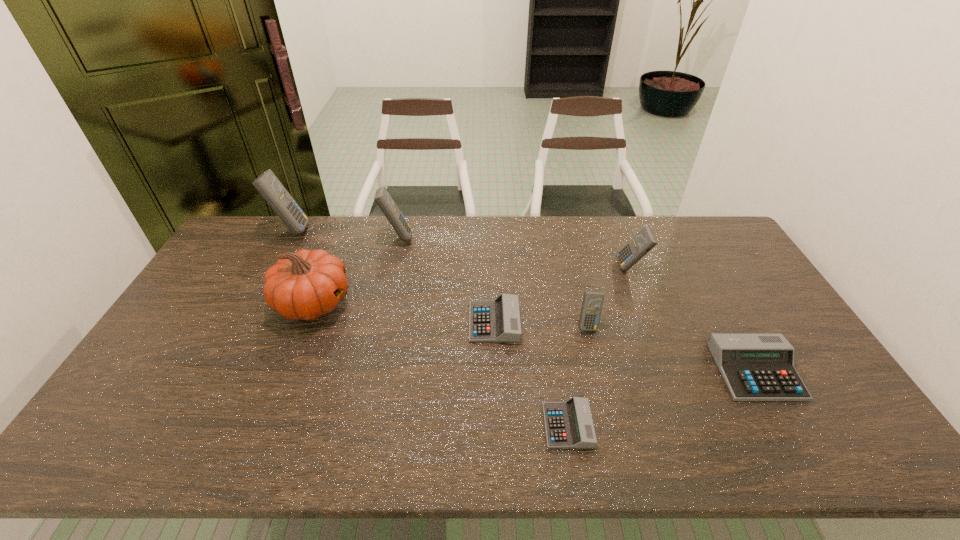
Identify the location of empty space between the third tallest calculator and the pumpkin. (472, 285).

This screenshot has width=960, height=540. I want to click on free spot between the fifth object from right to left and the third tallest calculator, so click(x=563, y=294).

The width and height of the screenshot is (960, 540). I want to click on unoccupied position between the tallest object and the fourth calculator from right to left, so click(429, 327).

Identify the location of free spot between the second tallest calculator and the fifth tallest object. (492, 281).

Image resolution: width=960 pixels, height=540 pixels. I want to click on object that is the third closest to the smallest gray calculator, so click(x=755, y=367).

Locate an element on the screen. the sixth closest object relative to the sixth shortest calculator is located at coordinates (x=569, y=424).

Locate an element on the screen. The width and height of the screenshot is (960, 540). the third closest calculator relative to the smallest blue calculator is located at coordinates (569, 424).

The width and height of the screenshot is (960, 540). Identify the location of calculator that is the fifth closest one to the second calculator from right to left. (382, 197).

Select which blue calculator appears as the third closest to the rightmost gray calculator. Please provide its 2D coordinates. Your answer should be formatted as a tuple, i.e. [(x, y)], where the tuple contains the x and y coordinates of a point satisfying the conditions above.

[(382, 197)]

Select which blue calculator is the closest to the second biggest blue calculator. Please provide its 2D coordinates. Your answer should be formatted as a tuple, i.e. [(x, y)], where the tuple contains the x and y coordinates of a point satisfying the conditions above.

[(267, 184)]